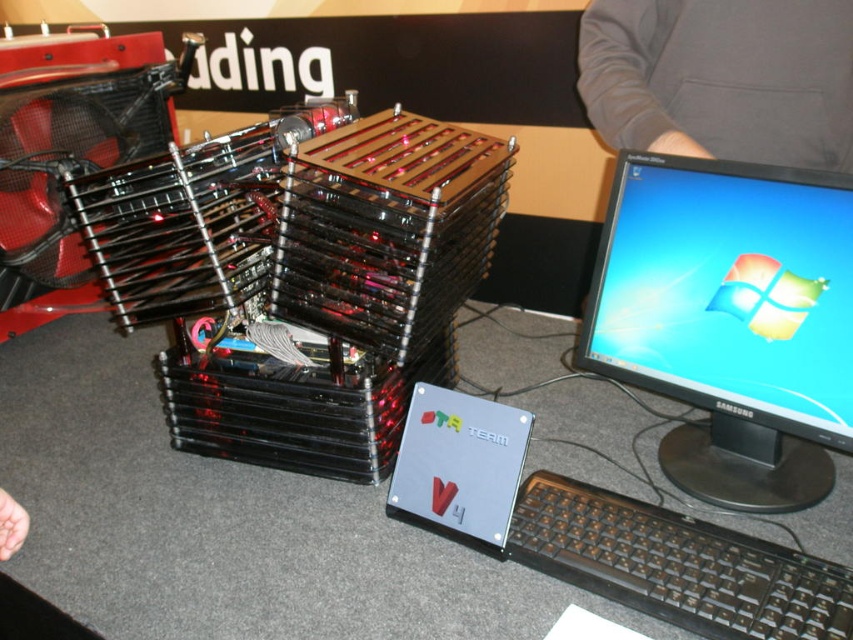
Question: Which point is closer to the camera?

Choices:
 (A) gray fabric sleeve at upper right
 (B) matte plastic monitor at right
 (C) silver metallic hard drive at center

Answer: (C)

Question: From the image, what is the correct spatial relationship of black plastic table at center in relation to silver metallic hard drive at center?

Choices:
 (A) right
 (B) left

Answer: (B)

Question: Among these objects, which one is farthest from the camera?

Choices:
 (A) matte plastic monitor at right
 (B) black plastic keyboard at lower right
 (C) gray fabric sleeve at upper right

Answer: (C)

Question: Which object is the farthest from the gray fabric sleeve at upper right?

Choices:
 (A) black plastic keyboard at lower right
 (B) silver metallic hard drive at center

Answer: (A)

Question: Can you confirm if black plastic table at center is smaller than gray fabric sleeve at upper right?

Choices:
 (A) no
 (B) yes

Answer: (A)

Question: Is black plastic table at center behind black plastic keyboard at lower right?

Choices:
 (A) no
 (B) yes

Answer: (B)